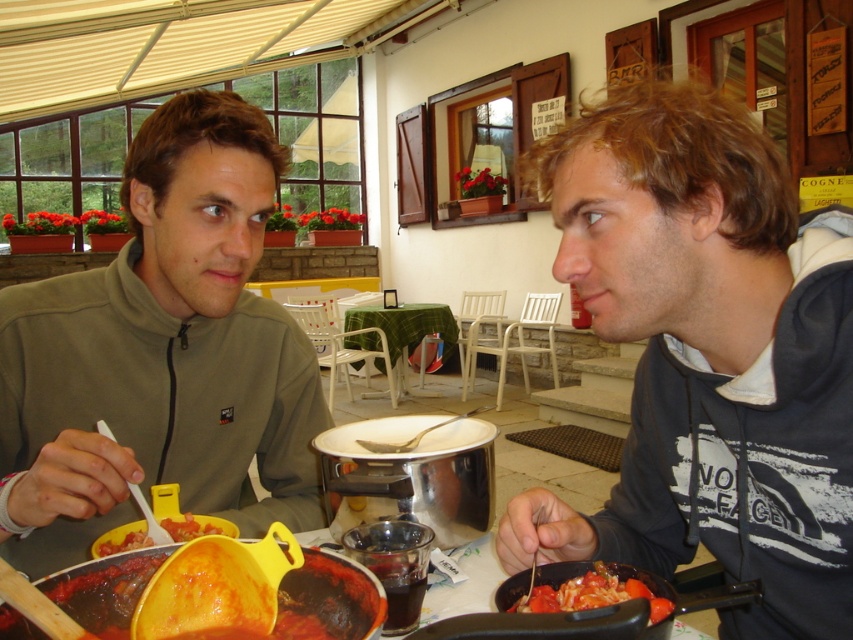
Question: Where is dark gray hoodie at right located in relation to green fabric table at center in the image?

Choices:
 (A) right
 (B) left

Answer: (A)

Question: Which of the following is the closest to the observer?

Choices:
 (A) yellow plastic spoon at lower left
 (B) green fabric table at center
 (C) matte green jacket at left
 (D) dark gray hoodie at right

Answer: (A)

Question: Considering the relative positions of dark gray hoodie at right and green fabric table at center in the image provided, where is dark gray hoodie at right located with respect to green fabric table at center?

Choices:
 (A) right
 (B) left

Answer: (A)

Question: Which point is farther to the camera?

Choices:
 (A) (192, 536)
 (B) (172, 134)
 (C) (581, 604)
 (D) (764, 477)

Answer: (B)

Question: Does matte green jacket at left have a greater width compared to tomato sauce at lower left?

Choices:
 (A) yes
 (B) no

Answer: (A)

Question: Which point is closer to the camera?

Choices:
 (A) tomato sauce pasta at lower center
 (B) green fabric table at center
 (C) yellow plastic spoon at lower left

Answer: (C)